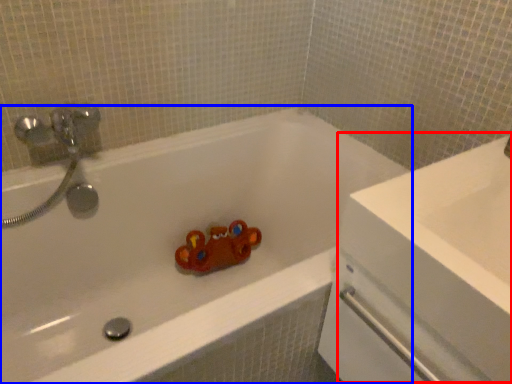
Question: Which object appears farthest to the camera in this image, counter top (highlighted by a red box) or bathtub (highlighted by a blue box)?

Choices:
 (A) counter top
 (B) bathtub

Answer: (B)